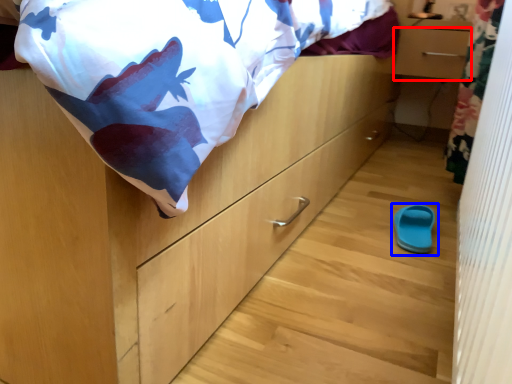
Question: Which object is further to the camera taking this photo, drawer (highlighted by a red box) or footwear (highlighted by a blue box)?

Choices:
 (A) drawer
 (B) footwear

Answer: (A)